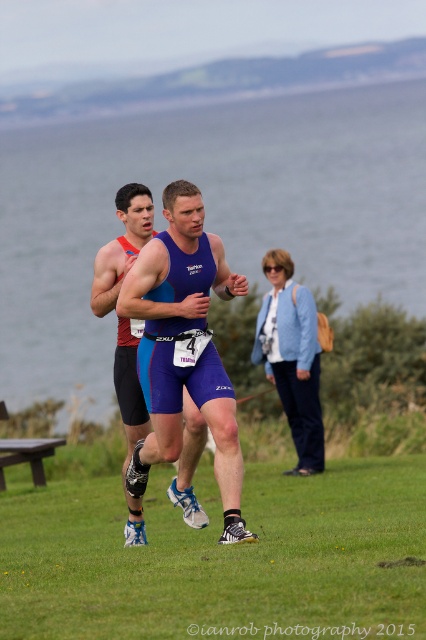
You are a participant in the triathlon and need to navigate between the two points marked in the image. Which point, point (68, 579) or point (226, 278), is closer to you as you run along the course?

Point (68, 579) is closer to you than point (226, 278).

You are a photographer standing at the edge of the lake where the triathlon is happening. You want to take a photo that includes both the green grass at lower center and the blue fabric tank top at center. What is the minimum distance you need to move backward to ensure both are in frame?

The minimum distance you need to move backward is 4.05 meters to include both the green grass at lower center and the blue fabric tank top at center in the frame.